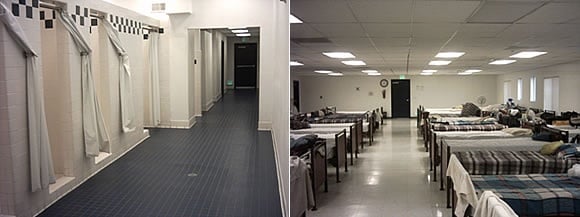
Where is `quilt`? The height and width of the screenshot is (217, 580). quilt is located at coordinates (480, 161).